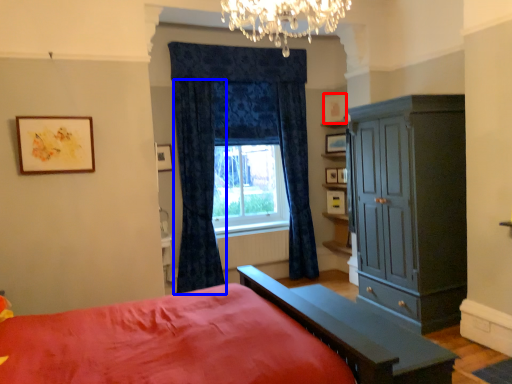
Question: Among these objects, which one is nearest to the camera, picture frame (highlighted by a red box) or curtain (highlighted by a blue box)?

Choices:
 (A) picture frame
 (B) curtain

Answer: (B)